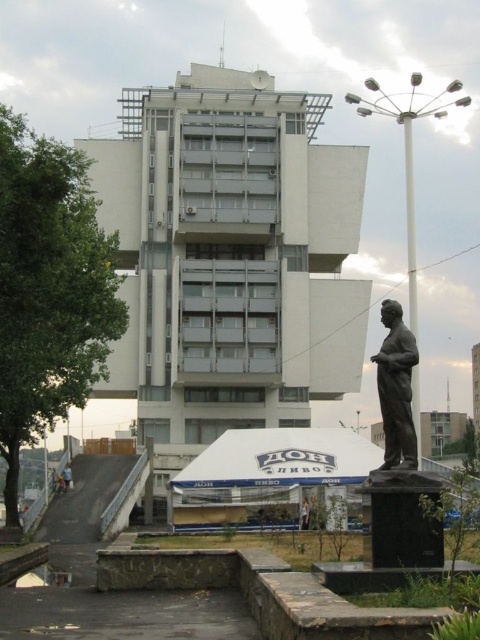
You are standing in front of the modern building and want to take a photo that includes both the white tent with the blue logo and the statue of the man. Which point, point (394,440) or point (71,481), is closer to your current position?

Point (394,440) is closer to the camera than point (71,481), so it is closer to your current position.